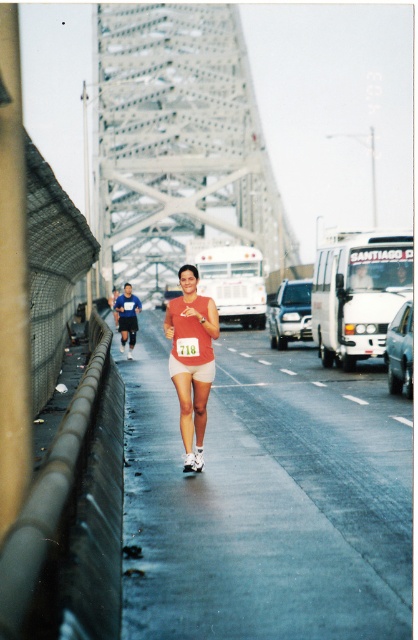
Looking at this image, is gray metallic bridge at center above matte orange tank top at center?

Yes, gray metallic bridge at center is above matte orange tank top at center.

Does gray metallic bridge at center have a larger size compared to matte orange tank top at center?

Correct, gray metallic bridge at center is larger in size than matte orange tank top at center.

The height and width of the screenshot is (640, 418). Find the location of `gray metallic bridge at center`. gray metallic bridge at center is located at coordinates (178, 141).